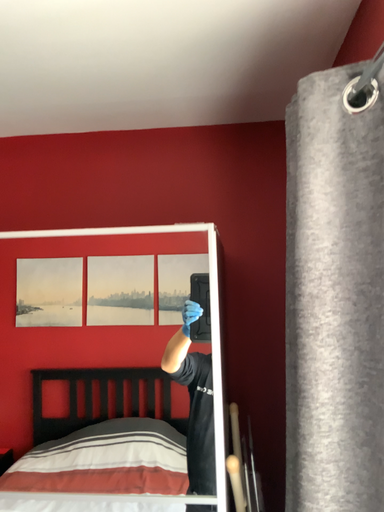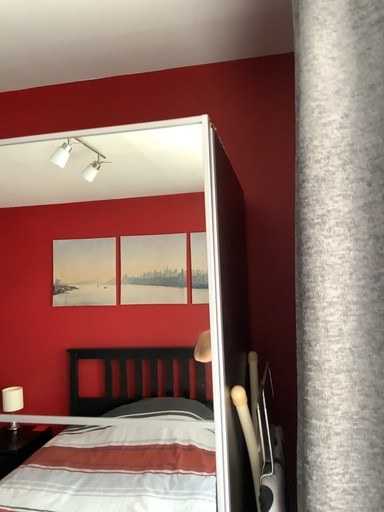
Question: Which way did the camera rotate in the video?

Choices:
 (A) rotated left
 (B) rotated right

Answer: (A)